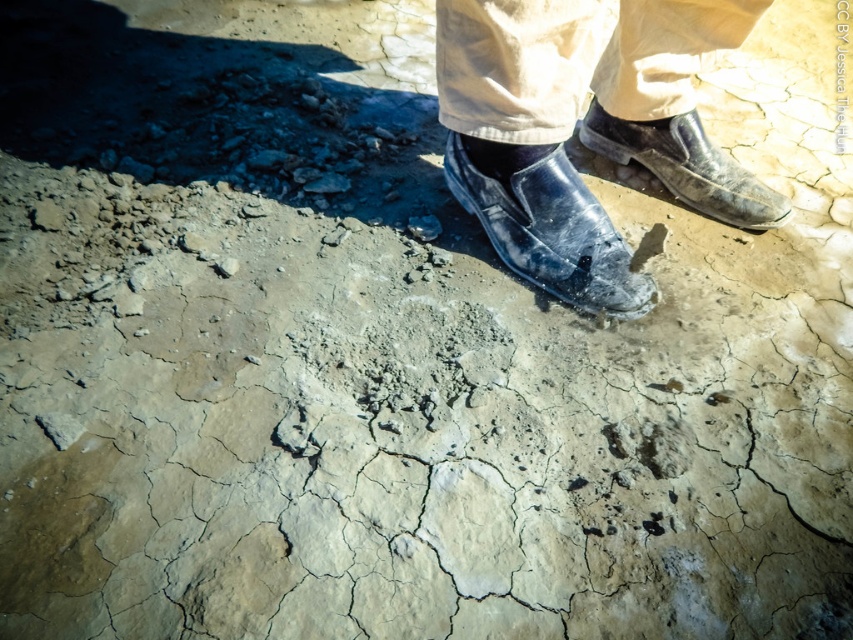
Question: Observing the image, what is the correct spatial positioning of shiny black shoes at center in reference to leather shoes at center?

Choices:
 (A) right
 (B) left

Answer: (B)

Question: Which of these objects is positioned farthest from the leather shoes at center?

Choices:
 (A) shiny black slip-on shoe at center
 (B) shiny black shoes at center

Answer: (B)

Question: Which point is closer to the camera taking this photo?

Choices:
 (A) (598, 150)
 (B) (585, 300)

Answer: (B)

Question: Does shiny black slip-on shoe at center have a lesser width compared to leather shoes at center?

Choices:
 (A) yes
 (B) no

Answer: (B)

Question: Which of these objects is positioned farthest from the leather shoes at center?

Choices:
 (A) shiny black slip-on shoe at center
 (B) shiny black shoes at center

Answer: (B)

Question: Is shiny black shoes at center to the left of shiny black slip-on shoe at center from the viewer's perspective?

Choices:
 (A) yes
 (B) no

Answer: (A)